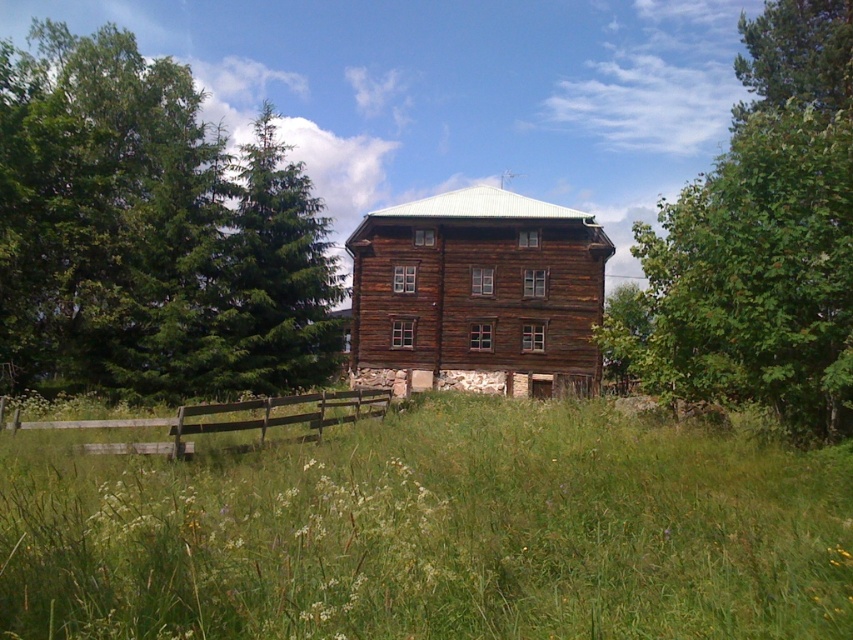
Question: Estimate the real-world distances between objects in this image. Which object is closer to the wooden at center?

Choices:
 (A) green textured pine tree at upper left
 (B) green leafy tree at upper right

Answer: (B)

Question: Is the position of green grassy field at center less distant than that of wooden at center?

Choices:
 (A) yes
 (B) no

Answer: (A)

Question: Among these points, which one is farthest from the camera?

Choices:
 (A) (682, 365)
 (B) (146, 579)

Answer: (A)

Question: Is green leafy tree at upper right above wooden at center?

Choices:
 (A) no
 (B) yes

Answer: (B)

Question: Does green grassy field at center have a smaller size compared to green textured pine tree at upper left?

Choices:
 (A) yes
 (B) no

Answer: (A)

Question: Which of the following is the farthest from the observer?

Choices:
 (A) (155, 72)
 (B) (279, 243)
 (C) (268, 403)

Answer: (A)